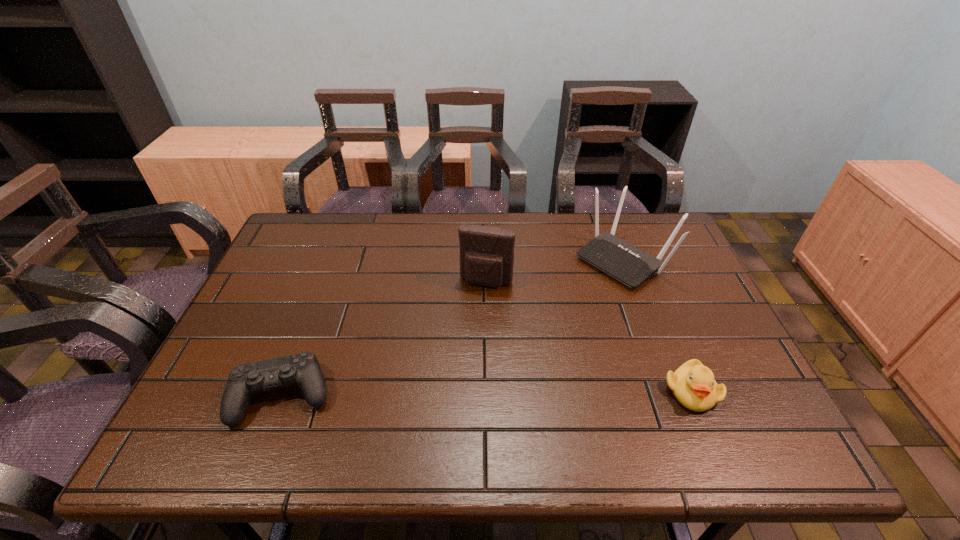
Locate an element on the screen. This screenshot has width=960, height=540. free space at the far edge of the desktop is located at coordinates (562, 233).

Find the location of `vacant space at the near edge of the desktop`. vacant space at the near edge of the desktop is located at coordinates (539, 403).

Find the location of a particular element. The height and width of the screenshot is (540, 960). vacant space at the left edge of the desktop is located at coordinates (273, 316).

This screenshot has height=540, width=960. In order to click on free space at the right edge of the desktop in this screenshot , I will do `click(701, 302)`.

Where is `free space at the far right corner`? free space at the far right corner is located at coordinates point(653,215).

The image size is (960, 540). In the image, there is a desktop. Find the location of `vacant space at the near right corner`. vacant space at the near right corner is located at coordinates (735, 385).

What are the coordinates of `free spot between the duckling and the third object from right to left` in the screenshot? It's located at (588, 336).

This screenshot has height=540, width=960. I want to click on free space that is in between the pouch and the router, so (x=555, y=271).

Find the location of a particular element. free space between the leftmost object and the duckling is located at coordinates (488, 393).

You are a GUI agent. You are given a task and a screenshot of the screen. Output one action in this format:
    pyautogui.click(x=<x>, y=<y>)
    Task: Click on the free space between the pouch and the router
    
    Given the screenshot: What is the action you would take?
    pyautogui.click(x=555, y=271)